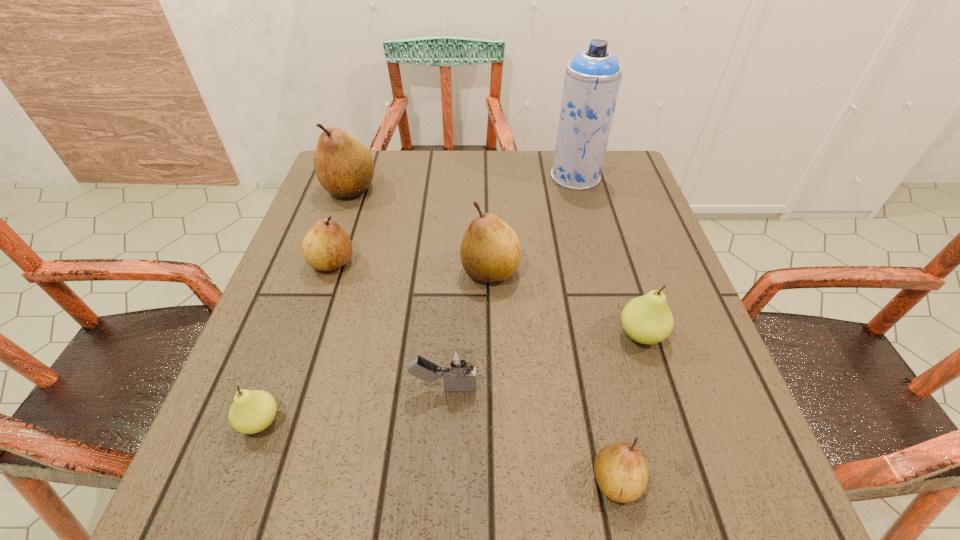
At what (x,y) coordinates should I click in order to perform the action: click on the smaller green pear. Please return your answer as a coordinate pair (x, y). Image resolution: width=960 pixels, height=540 pixels. Looking at the image, I should click on click(251, 412).

Find the location of a particular element. the fifth farthest pear is located at coordinates (251, 412).

Locate an element on the screen. The width and height of the screenshot is (960, 540). the nearest pear is located at coordinates (621, 472).

Locate an element on the screen. The width and height of the screenshot is (960, 540). the fifth pear from left to right is located at coordinates (621, 472).

Where is `vacant area situated 0.200m on the front of the tallest object`? vacant area situated 0.200m on the front of the tallest object is located at coordinates (593, 242).

I want to click on vacant space located 0.080m on the front of the second tallest object, so click(336, 227).

I want to click on vacant region located 0.220m on the right of the second biggest brown pear, so click(x=624, y=271).

Find the location of a particular element. The height and width of the screenshot is (540, 960). vacant space situated 0.070m on the back of the third biggest brown pear is located at coordinates (344, 227).

Where is `vacant space located on the right of the rightmost pear`? The width and height of the screenshot is (960, 540). vacant space located on the right of the rightmost pear is located at coordinates tap(703, 334).

Identify the location of vacant space situated 0.220m on the back of the igniter. (450, 280).